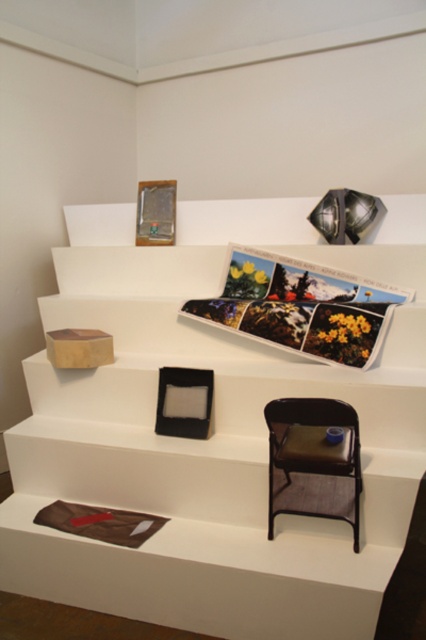
Between wooden box at upper left and brown leather chair at lower right, which one has less height?

brown leather chair at lower right

Does wooden box at upper left have a larger size compared to brown leather chair at lower right?

Correct, wooden box at upper left is larger in size than brown leather chair at lower right.

The height and width of the screenshot is (640, 426). Describe the element at coordinates (210, 433) in the screenshot. I see `wooden box at upper left` at that location.

Where is `wooden box at upper left`? The image size is (426, 640). wooden box at upper left is located at coordinates (210, 433).